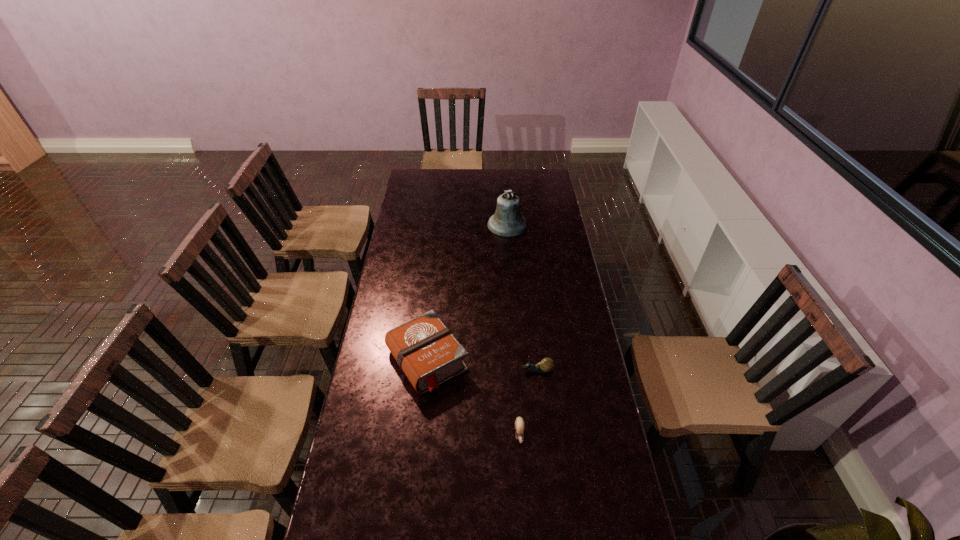
Find the location of a particular element. This screenshot has height=540, width=960. free space located on the front-facing side of the second shortest object is located at coordinates (470, 370).

Identify the location of free space located on the front-facing side of the second shortest object. (424, 370).

Locate an element on the screen. blank area located on the front-facing side of the second shortest object is located at coordinates (435, 370).

You are a GUI agent. You are given a task and a screenshot of the screen. Output one action in this format:
    pyautogui.click(x=<x>, y=<y>)
    Task: Click on the vacant area situated 0.080m on the front-facing side of the shortest object
    The height and width of the screenshot is (540, 960).
    Given the screenshot: What is the action you would take?
    (x=522, y=472)

I want to click on object located in the left edge section of the desktop, so click(x=426, y=350).

Where is `object present at the right edge`? object present at the right edge is located at coordinates (546, 365).

Image resolution: width=960 pixels, height=540 pixels. Find the location of `free space at the far edge`. free space at the far edge is located at coordinates (485, 190).

Locate an element on the screen. This screenshot has width=960, height=540. vacant space at the left edge is located at coordinates (364, 441).

The image size is (960, 540). In the image, there is a desktop. Identify the location of vacant area at the right edge. (571, 266).

The width and height of the screenshot is (960, 540). What are the coordinates of `blank area at the far right corner` in the screenshot? It's located at (555, 185).